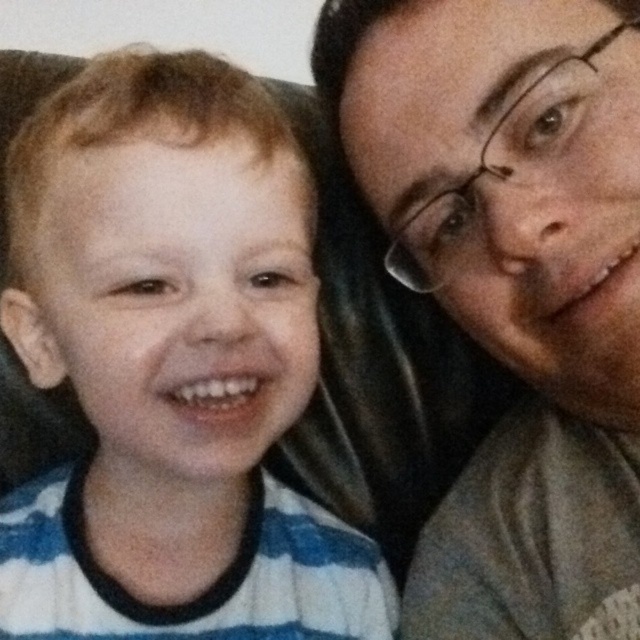
You are trying to decide which clothing item to wash first. You see the white striped sweater at left and the matte gray shirt at right. Which one has a larger size?

The white striped sweater at left is bigger than the matte gray shirt at right, so it has a larger size.

You are a photographer taking a picture of two people sitting on a couch. You need to ensure that both the white striped sweater at left and the matte gray shirt at right are clearly visible in the photo. Based on their positions, which one might be easier to see in the final image?

The white striped sweater at left is in front of the matte gray shirt at right, so the white striped sweater at left will be more visible in the photo.